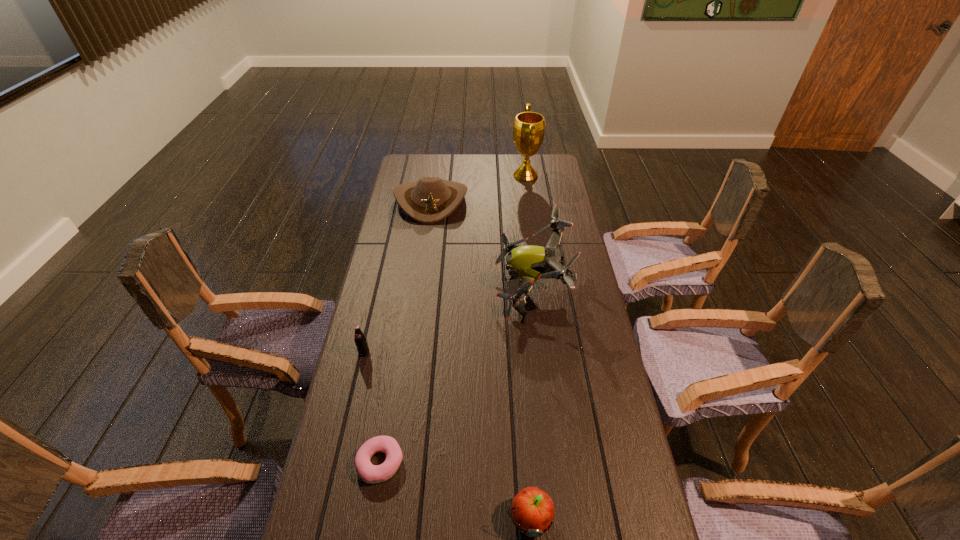
Where is `free space that satisfies the following two spatial constraints: 1. on the front label of the pop; 2. on the left side of the second nearest object`? free space that satisfies the following two spatial constraints: 1. on the front label of the pop; 2. on the left side of the second nearest object is located at coordinates (339, 463).